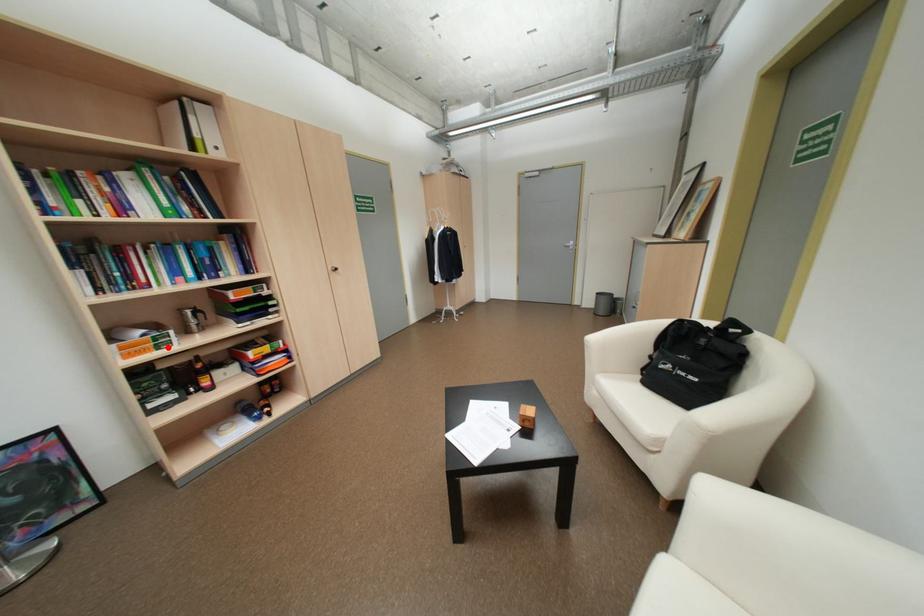
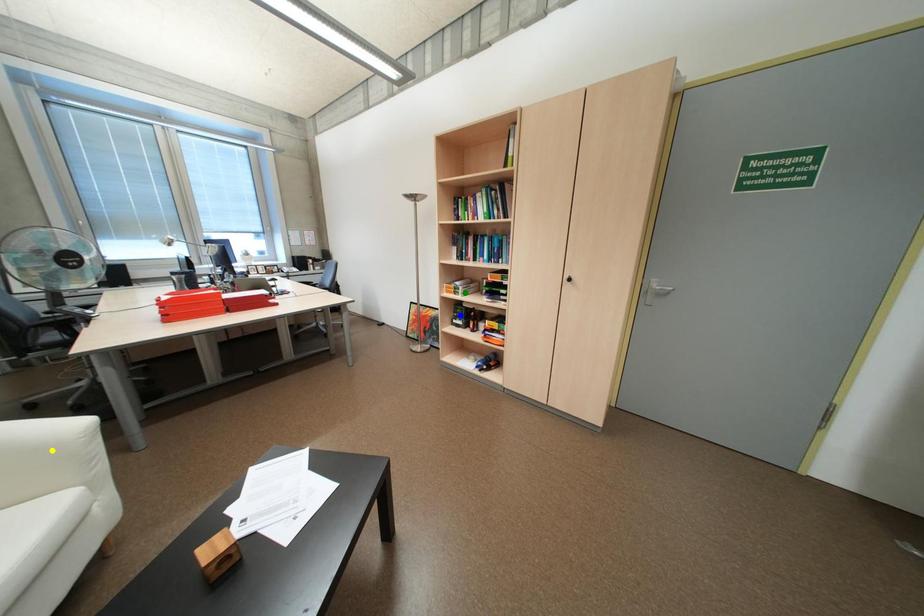
Question: I am providing you with two images of the same scene from different viewpoints. A red point is marked on the first image. You are given multiple points on the second image. Which mark in image 2 goes with the point in image 1?

Choices:
 (A) yellow point
 (B) green point
 (C) blue point

Answer: (B)